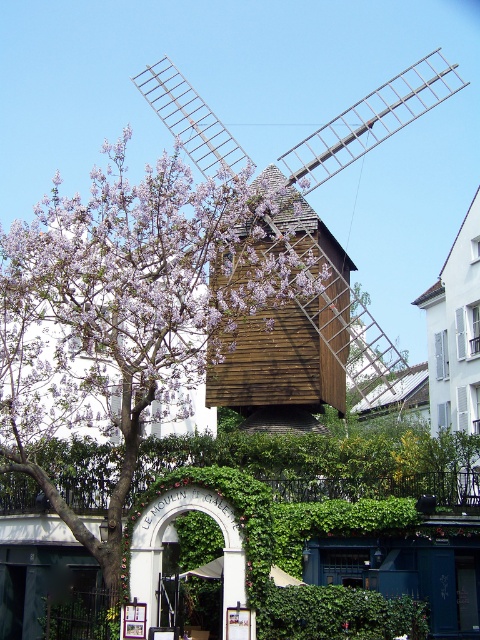
You are standing in front of the windmill and want to determine the relative positions of two points marked in the image. Which point, point 1 at coordinates [87,364] or point 2 at coordinates [215,173], is closer to you?

Point 1 at coordinates [87,364] is closer to the viewer than point 2 at coordinates [215,173].

You are a photographer standing at the base of the windmill. You want to take a photo that includes both the purple leafy tree at center and the white archway with the inscription. However, your camera has a maximum zoom range of 50 meters. Can you capture both objects in the same frame without moving your position?

The purple leafy tree at center is 52.70 meters from camera, which exceeds the camera maximum zoom range of 50 meters. Therefore, you cannot capture both objects in the same frame without moving your position.

You are a visitor at the historical site and want to take a photo of the purple leafy tree at center and the wooden windmill at center. Which object should you focus on first if you want to capture both in a single frame without moving your camera? Explain your reasoning based on their sizes.

The purple leafy tree at center is not as tall as the wooden windmill at center, so you should focus on the wooden windmill at center first to ensure it fits entirely in the frame, as it is taller and might require adjusting the camera angle to include its full height.